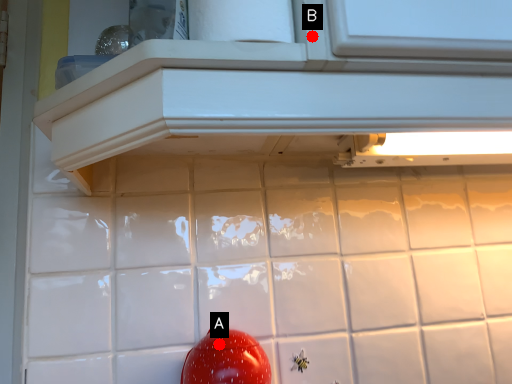
Question: Two points are circled on the image, labeled by A and B beside each circle. Which point is closer to the camera taking this photo?

Choices:
 (A) A is closer
 (B) B is closer

Answer: (B)